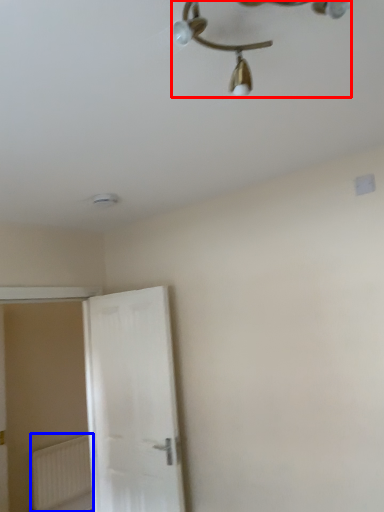
Question: Among these objects, which one is nearest to the camera, lamp (highlighted by a red box) or radiator (highlighted by a blue box)?

Choices:
 (A) lamp
 (B) radiator

Answer: (A)